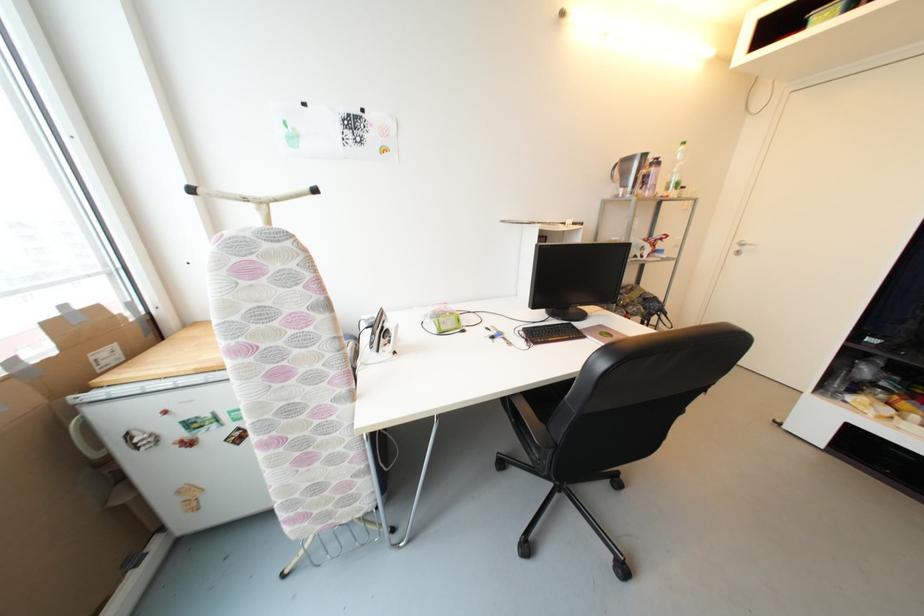
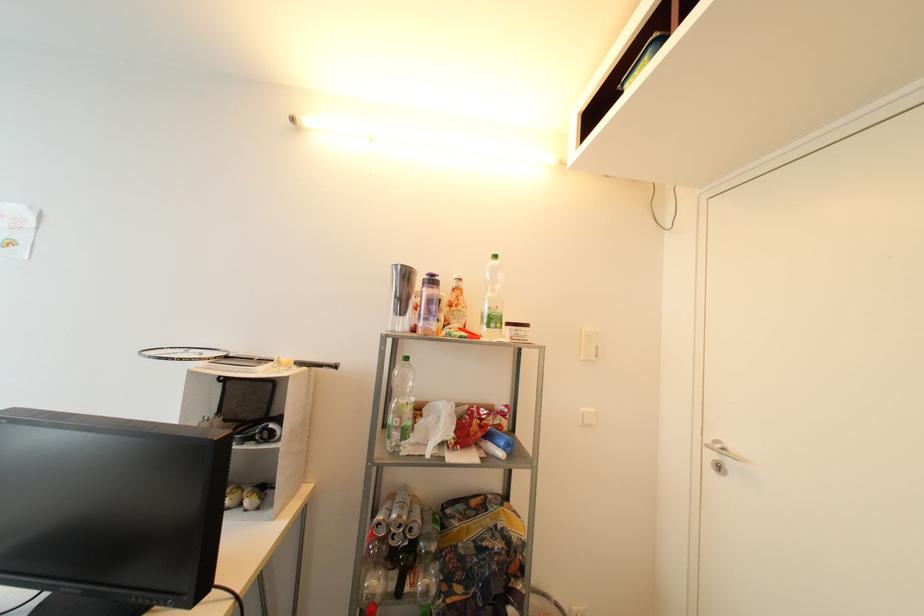
Where in the second image is the point corresponding to the point at 682,187 from the first image?

(499, 322)